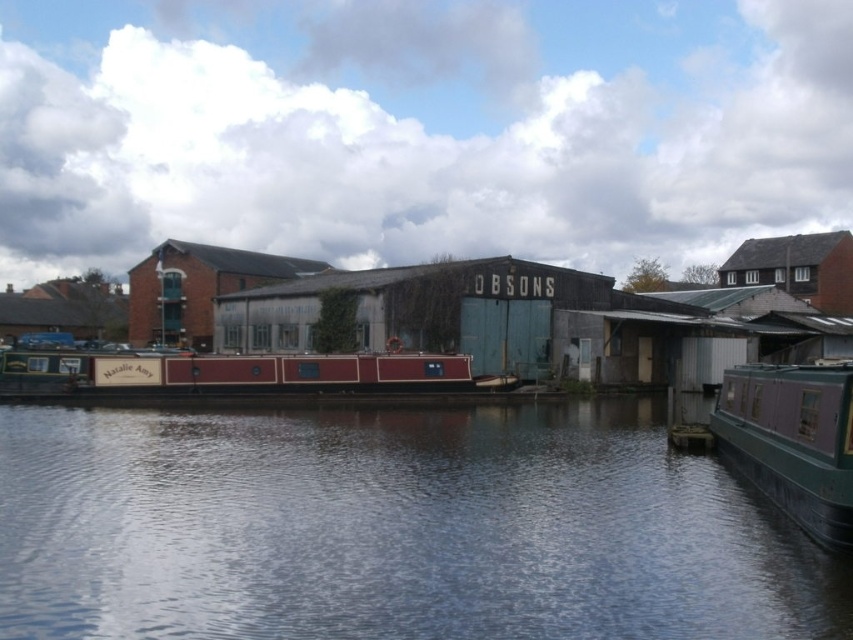
Question: Among these objects, which one is farthest from the camera?

Choices:
 (A) green matte barge at right
 (B) smooth water at center

Answer: (A)

Question: Does smooth water at center lie behind green matte barge at right?

Choices:
 (A) yes
 (B) no

Answer: (B)

Question: Which object is farther from the camera taking this photo?

Choices:
 (A) green matte barge at right
 (B) smooth water at center

Answer: (A)

Question: Which point is farther from the camera taking this photo?

Choices:
 (A) (814, 384)
 (B) (289, 634)

Answer: (A)

Question: Does smooth water at center lie in front of green matte barge at right?

Choices:
 (A) yes
 (B) no

Answer: (A)

Question: Can you confirm if smooth water at center is positioned below green matte barge at right?

Choices:
 (A) yes
 (B) no

Answer: (A)